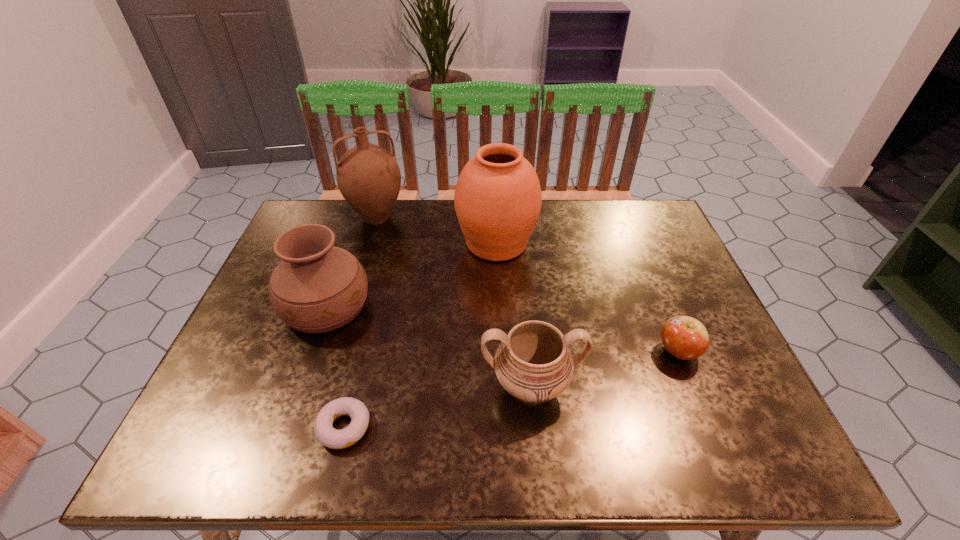
What are the coordinates of `pitcher` in the screenshot? It's located at (368, 176).

The width and height of the screenshot is (960, 540). Identify the location of the farthest urn. (498, 198).

Find the location of `the leftmost urn`. the leftmost urn is located at coordinates (316, 288).

The width and height of the screenshot is (960, 540). Find the location of `the second nearest urn`. the second nearest urn is located at coordinates (316, 288).

Locate an element on the screen. the fourth tallest object is located at coordinates (533, 363).

The height and width of the screenshot is (540, 960). Identify the location of the nearest urn. (533, 363).

Find the location of a particular element. The image size is (960, 540). the rightmost object is located at coordinates (684, 337).

The height and width of the screenshot is (540, 960). In order to click on the fifth tallest object in this screenshot , I will do [684, 337].

This screenshot has height=540, width=960. Identify the location of the shortest object. (328, 436).

You are a GUI agent. You are given a task and a screenshot of the screen. Output one action in this format:
    pyautogui.click(x=<x>, y=<y>)
    Task: Click on the free space located 0.050m on the front of the pitcher
    Image resolution: width=960 pixels, height=540 pixels.
    Given the screenshot: What is the action you would take?
    pyautogui.click(x=369, y=246)